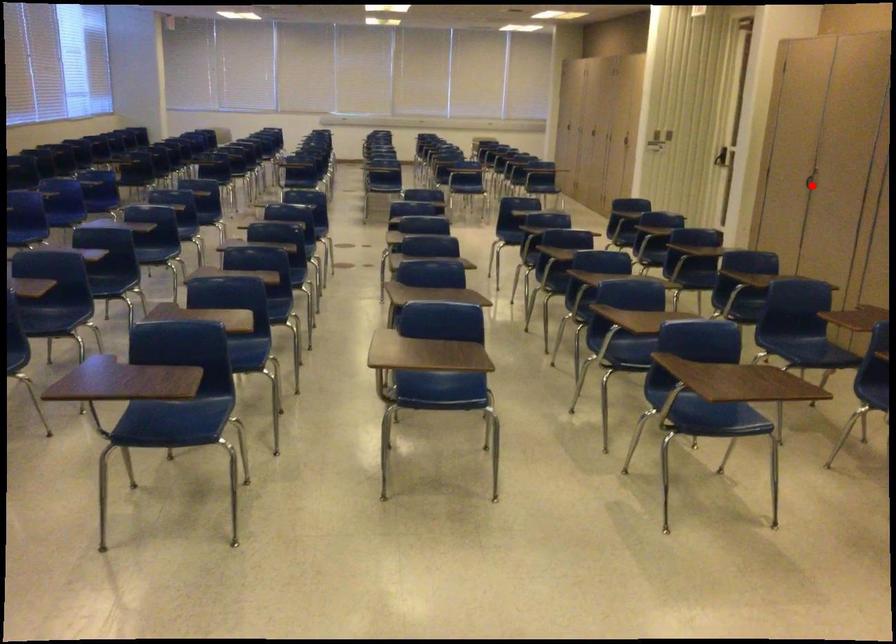
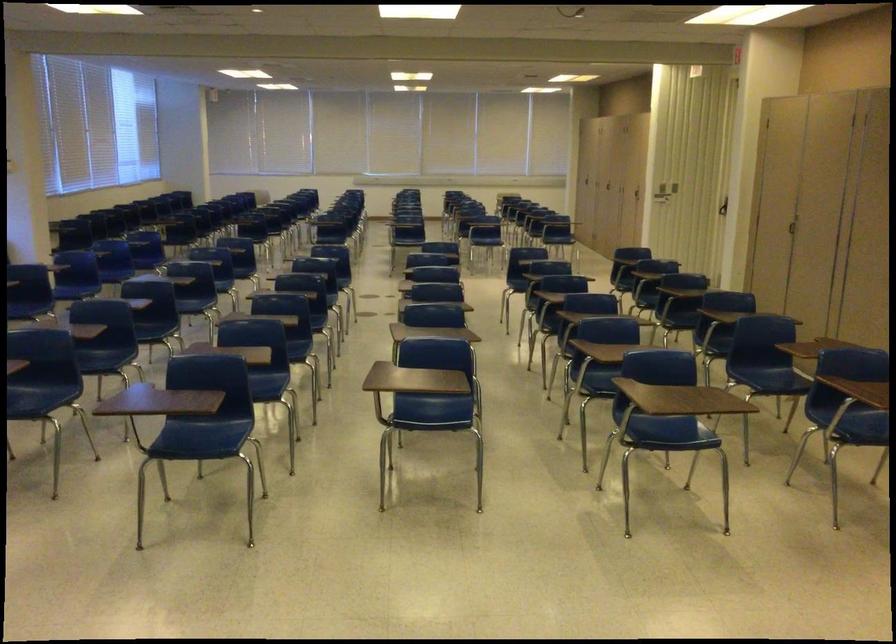
Find the pixel in the second image that matches the highlighted location in the first image.

(794, 228)